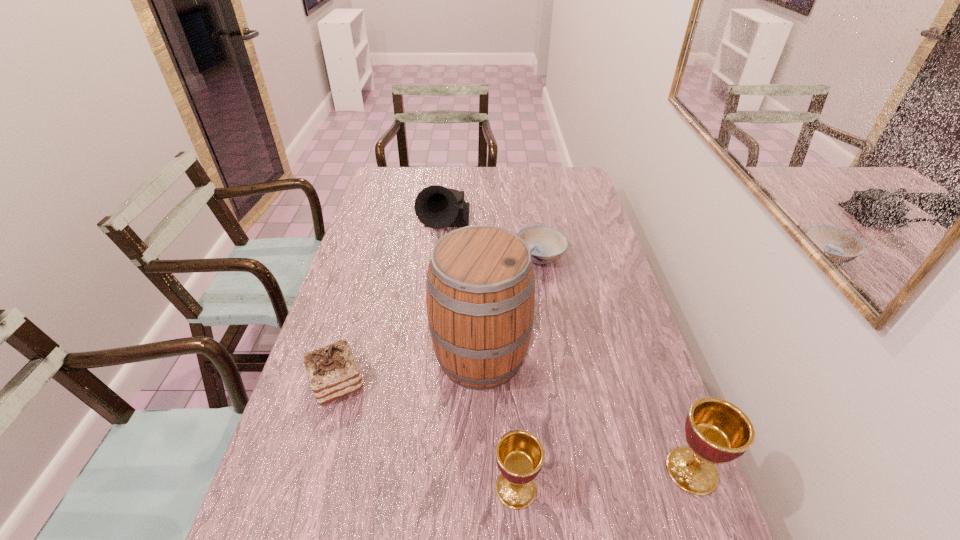
The width and height of the screenshot is (960, 540). In order to click on object that is the fourth nearest to the rightmost object in this screenshot , I will do `click(332, 370)`.

Choose which object is the fourth nearest neighbor to the bowl. Please provide its 2D coordinates. Your answer should be formatted as a tuple, i.e. [(x, y)], where the tuple contains the x and y coordinates of a point satisfying the conditions above.

[(717, 431)]

You are a GUI agent. You are given a task and a screenshot of the screen. Output one action in this format:
    pyautogui.click(x=<x>, y=<y>)
    Task: Click on the free point that satisfies the following two spatial constraints: 1. on the back side of the bowl; 2. on the left side of the chocolate cake
    
    Given the screenshot: What is the action you would take?
    pyautogui.click(x=373, y=256)